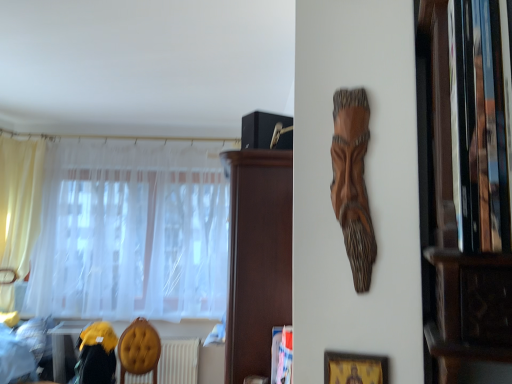
Question: Is white textured radiator at lower center spatially inside dark brown wood cabinet at upper center, or outside of it?

Choices:
 (A) outside
 (B) inside

Answer: (A)

Question: Is white textured radiator at lower center in front of or behind dark brown wood cabinet at upper center in the image?

Choices:
 (A) behind
 (B) front

Answer: (A)

Question: Estimate the real-world distances between objects in this image. Which object is farther from the white textured radiator at lower center?

Choices:
 (A) yellow fabric armchair at lower left
 (B) gold textured picture frame at lower right
 (C) wooden carving at upper center
 (D) yellow fabric at lower left
 (E) white sheer curtain at left, the 1th curtain positioned from the right

Answer: (C)

Question: Estimate the real-world distances between objects in this image. Which object is farther from the wooden carving at upper center?

Choices:
 (A) velvet yellow swivel chair at lower left
 (B) yellow fabric armchair at lower left
 (C) white sheer curtain at left, arranged as the 2th curtain when viewed from the left
 (D) white textured radiator at lower center
 (E) yellow sheer curtain at left, which is the second curtain in right-to-left order

Answer: (E)